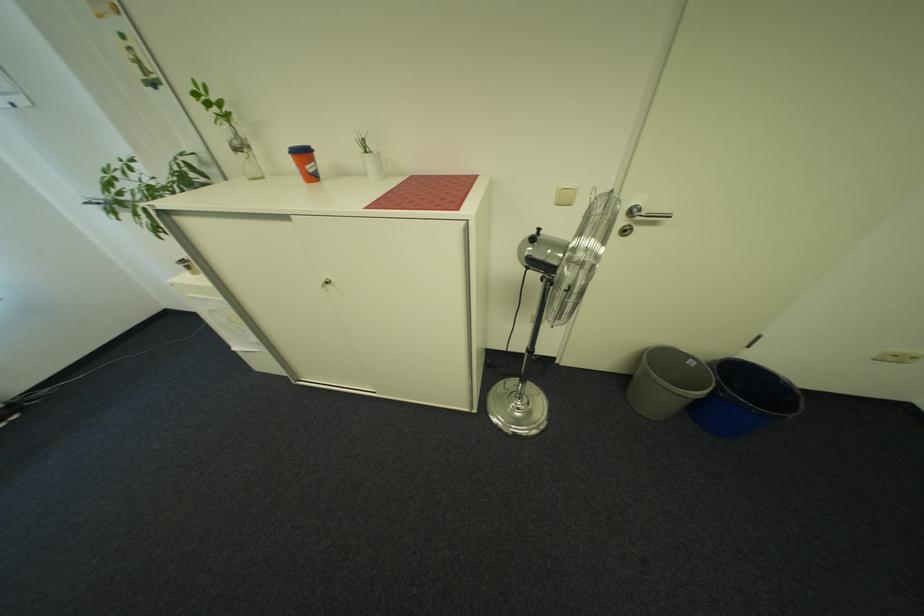
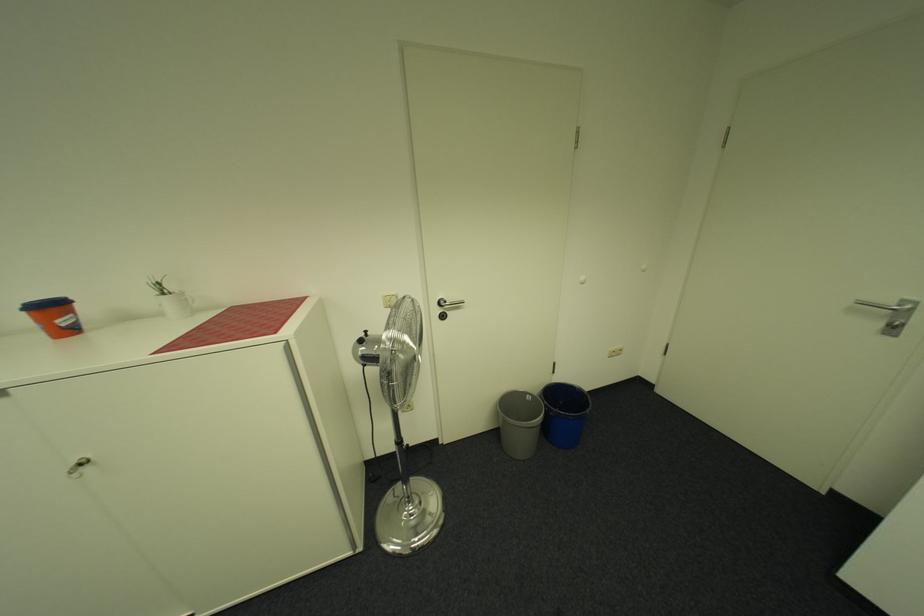
The point at [542,240] is marked in the first image. Where is the corresponding point in the second image?

(371, 342)